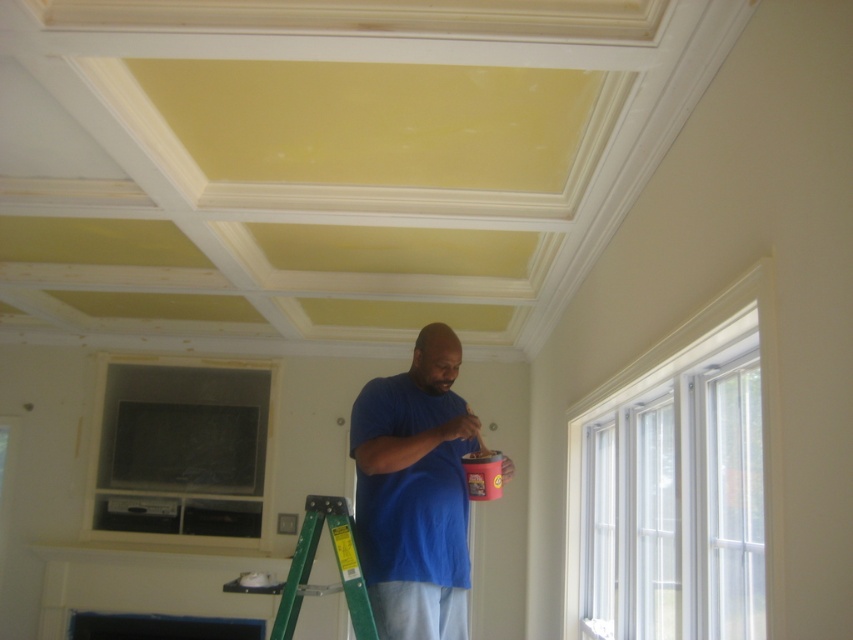
Question: Which point appears farthest from the camera in this image?

Choices:
 (A) (332, 588)
 (B) (440, 538)

Answer: (A)

Question: Does blue matte shirt at center have a greater width compared to green metallic ladder at lower center?

Choices:
 (A) yes
 (B) no

Answer: (A)

Question: Is blue matte shirt at center thinner than green metallic ladder at lower center?

Choices:
 (A) no
 (B) yes

Answer: (A)

Question: Among these points, which one is nearest to the camera?

Choices:
 (A) (309, 524)
 (B) (454, 394)

Answer: (A)

Question: Is blue matte shirt at center thinner than green metallic ladder at lower center?

Choices:
 (A) yes
 (B) no

Answer: (B)

Question: Which object appears farthest from the camera in this image?

Choices:
 (A) blue matte shirt at center
 (B) green metallic ladder at lower center

Answer: (A)